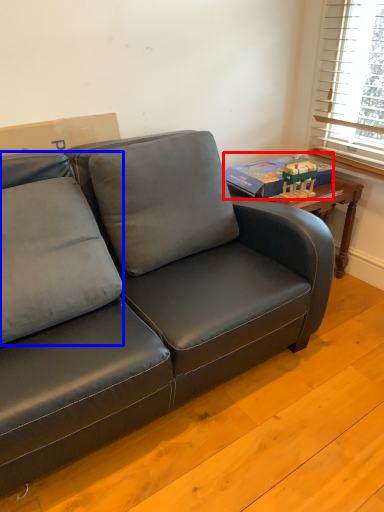
Question: Which of the following is the closest to the observer, paperback book (highlighted by a red box) or pillow (highlighted by a blue box)?

Choices:
 (A) paperback book
 (B) pillow

Answer: (B)